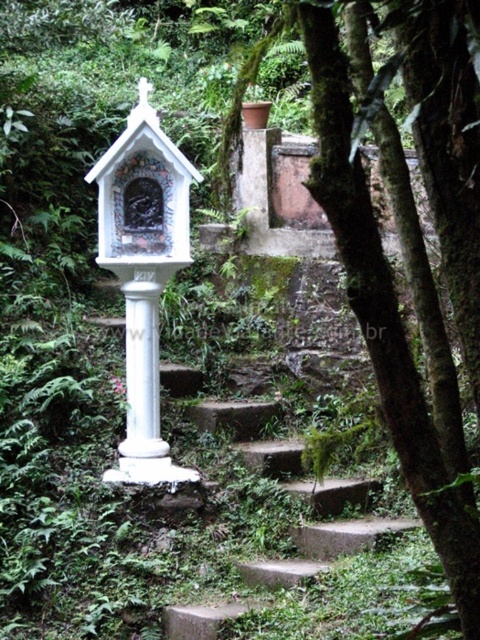
Is point (414, 404) positioned behind point (179, 202)?

That is False.

What do you see at coordinates (383, 314) in the screenshot? I see `green mossy bark tree at center` at bounding box center [383, 314].

The height and width of the screenshot is (640, 480). Find the location of `green mossy bark tree at center`. green mossy bark tree at center is located at coordinates (383, 314).